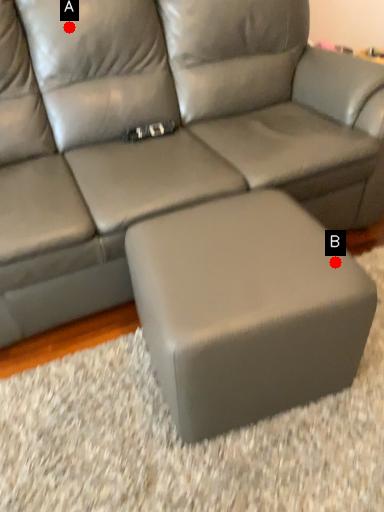
Question: Two points are circled on the image, labeled by A and B beside each circle. Which point is further to the camera?

Choices:
 (A) A is further
 (B) B is further

Answer: (A)